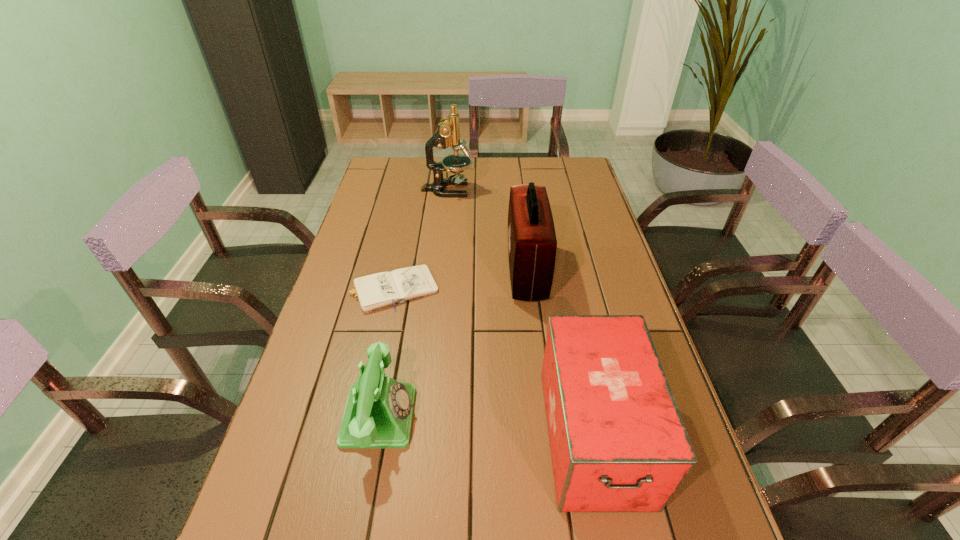
I want to click on free space at the far left corner of the desktop, so click(x=401, y=188).

Identify the location of free area in between the shorter first-aid kit and the tallest object. Image resolution: width=960 pixels, height=540 pixels. (520, 313).

You are a GUI agent. You are given a task and a screenshot of the screen. Output one action in this format:
    pyautogui.click(x=<x>, y=<y>)
    Task: Click on the free spot between the fourth shortest object and the shortest object
    This screenshot has height=540, width=960.
    Given the screenshot: What is the action you would take?
    pyautogui.click(x=459, y=280)

What are the coordinates of `empty location between the farther first-aid kit and the telephone` in the screenshot? It's located at (453, 343).

I want to click on free space between the notebook and the shorter first-aid kit, so click(492, 362).

I want to click on vacant region between the shorter first-aid kit and the notebook, so click(492, 362).

You are a GUI agent. You are given a task and a screenshot of the screen. Output one action in this format:
    pyautogui.click(x=<x>, y=<y>)
    Task: Click on the empty space that is in between the notebook and the taller first-aid kit
    
    Given the screenshot: What is the action you would take?
    [459, 280]

This screenshot has width=960, height=540. Find the location of `free spot between the telephone and the nearer first-aid kit`. free spot between the telephone and the nearer first-aid kit is located at coordinates (487, 426).

Image resolution: width=960 pixels, height=540 pixels. Identify the location of empty space that is in between the shortest object and the tallest object. (420, 239).

Where is `empty space between the microscope and the taller first-aid kit`? The width and height of the screenshot is (960, 540). empty space between the microscope and the taller first-aid kit is located at coordinates (487, 230).